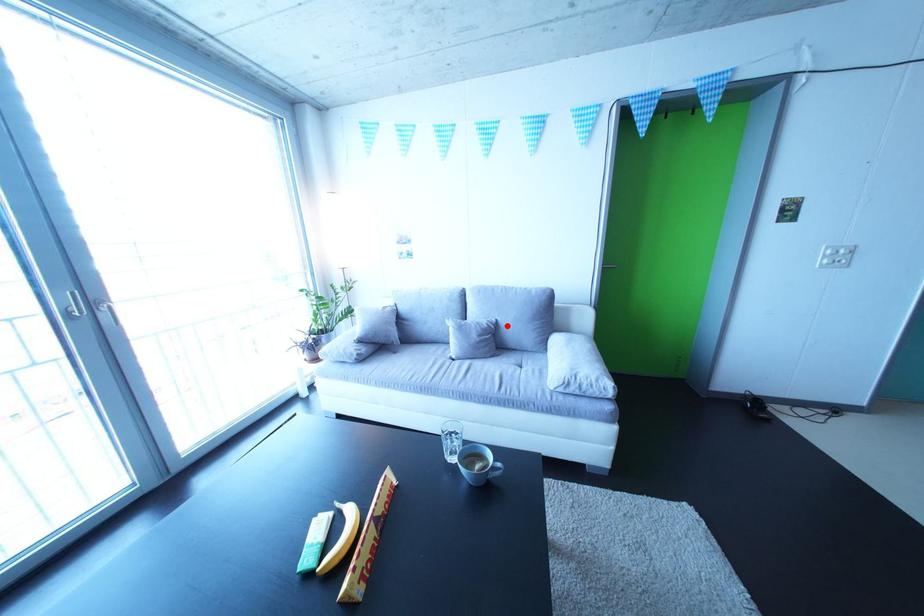
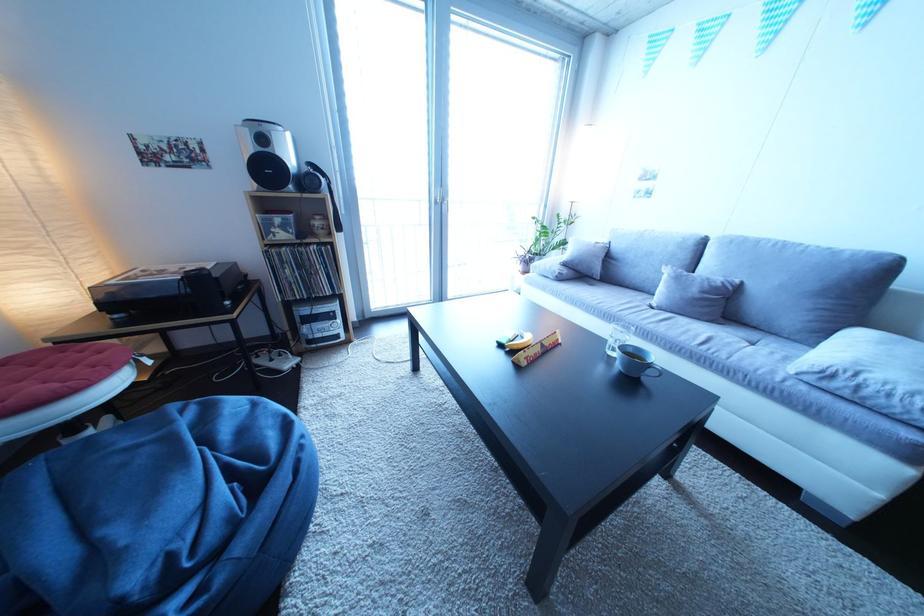
In the second image, find the point that corresponds to the highlighted location in the first image.

(750, 286)